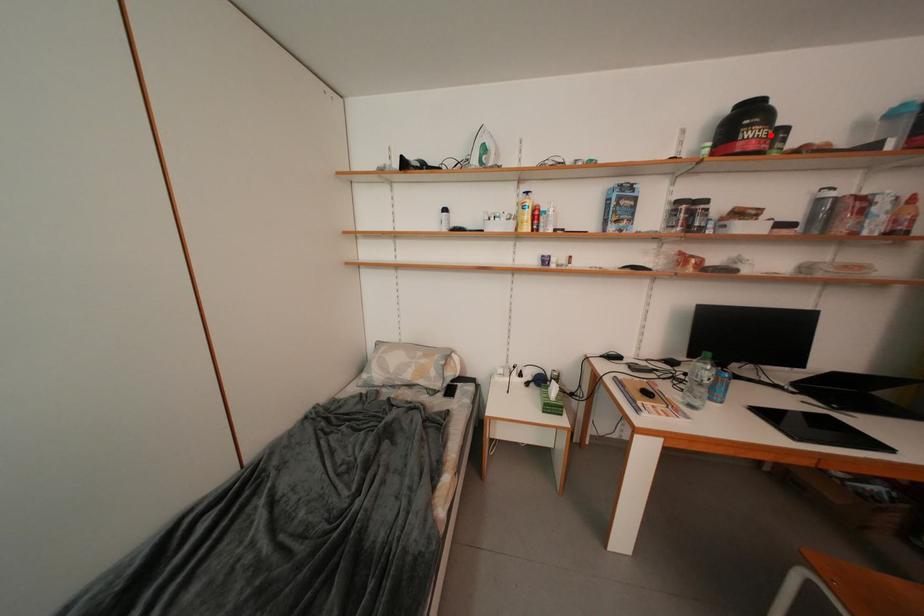
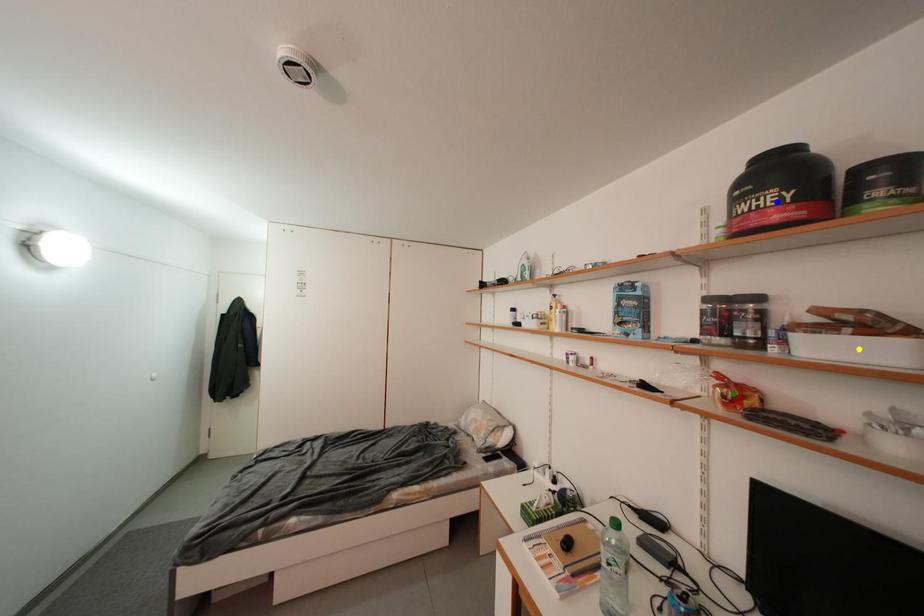
Question: I am providing you with two images of the same scene from different viewpoints. A red point is marked on the first image. You are given multiple points on the second image. Which point in image 2 is actually the same real-world point as the red point in image 1?

Choices:
 (A) blue point
 (B) green point
 (C) yellow point

Answer: (A)